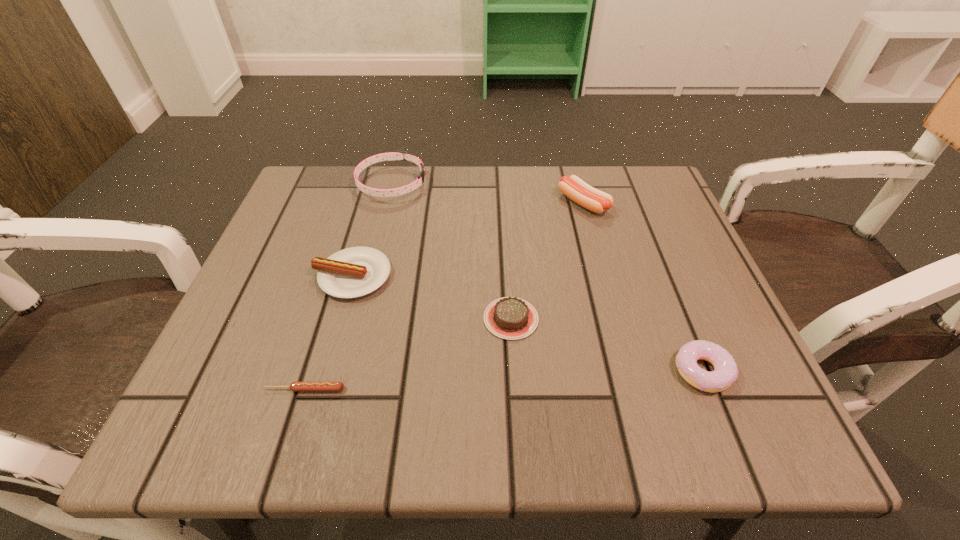
In the image, there is a desktop. Where is `free space at the far left corner`? This screenshot has height=540, width=960. free space at the far left corner is located at coordinates (361, 173).

Where is `free space at the far right corner of the desktop`? free space at the far right corner of the desktop is located at coordinates (613, 190).

Image resolution: width=960 pixels, height=540 pixels. Identify the location of blank region between the fifth object from left to right and the dog collar. (488, 193).

Find the location of `vacant space that is in between the second nearest sausage and the farthest sausage`. vacant space that is in between the second nearest sausage and the farthest sausage is located at coordinates (468, 239).

At what (x,y) coordinates should I click in order to perform the action: click on blank region between the fourth object from left to right and the dog collar. Please return your answer as a coordinate pair (x, y). Looking at the image, I should click on (451, 251).

What are the coordinates of `empty space that is in between the chocolate cake and the shortest object` in the screenshot? It's located at (408, 354).

The width and height of the screenshot is (960, 540). What are the coordinates of `free space between the second shortest object and the second shortest sausage` in the screenshot? It's located at (x=432, y=297).

Locate an element on the screen. vacant region between the farthest sausage and the dog collar is located at coordinates (488, 193).

At what (x,y) coordinates should I click in order to perform the action: click on empty space that is in between the dog collar and the rightmost sausage. Please return your answer as a coordinate pair (x, y). This screenshot has width=960, height=540. Looking at the image, I should click on (488, 193).

You are a GUI agent. You are given a task and a screenshot of the screen. Output one action in this format:
    pyautogui.click(x=<x>, y=<y>)
    Task: Click on the free space between the dog collar and the fifth tallest object
    
    Given the screenshot: What is the action you would take?
    point(451,251)